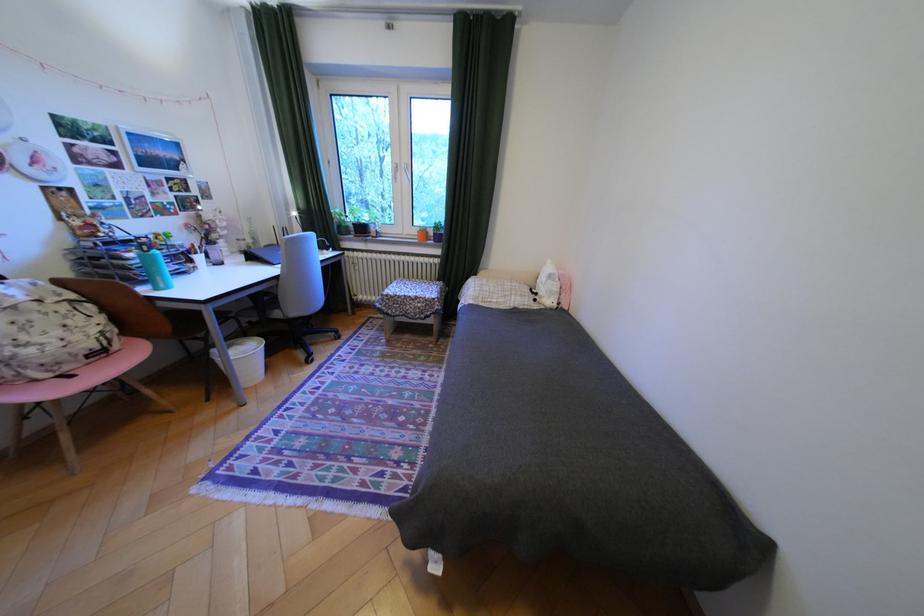
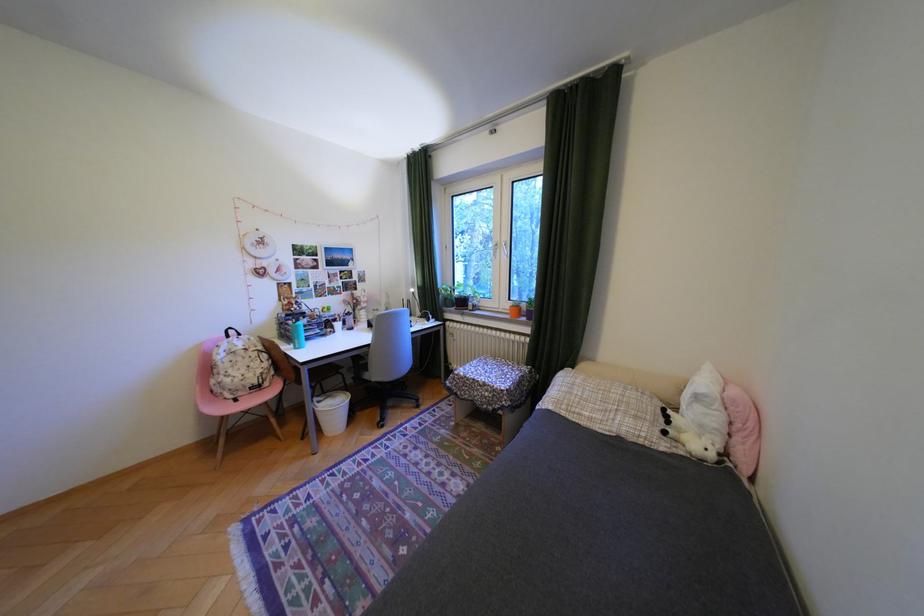
The point at (570, 304) is marked in the first image. Where is the corresponding point in the second image?

(736, 455)